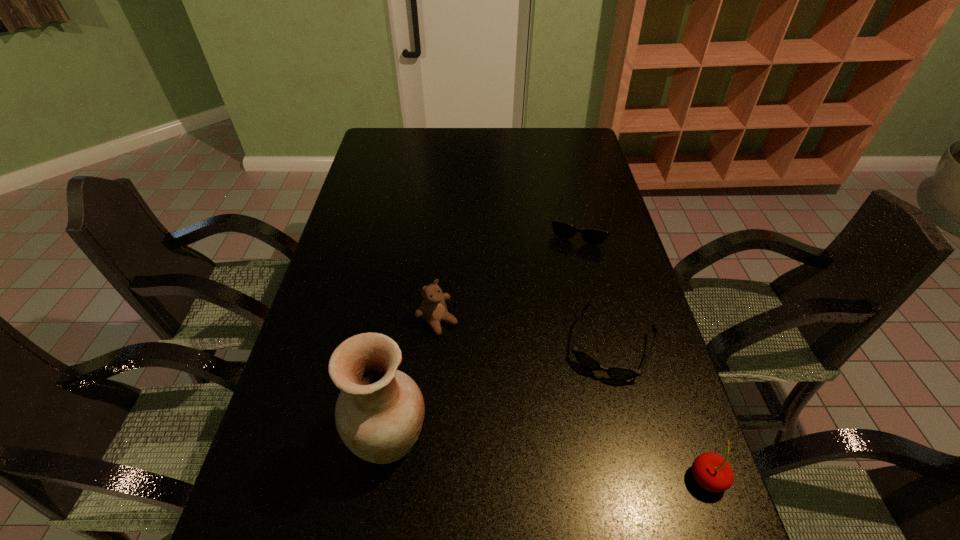
Where is `empty space that is in between the cherry and the teddy bear`? empty space that is in between the cherry and the teddy bear is located at coordinates (572, 400).

The image size is (960, 540). What are the coordinates of `empty space between the farther sunglasses and the nearer sunglasses` in the screenshot? It's located at (596, 285).

Find the location of `empty location between the cherry and the teddy bear`. empty location between the cherry and the teddy bear is located at coordinates pos(572,400).

Find the location of a particular element. This screenshot has height=540, width=960. free area in between the farthest object and the nearer sunglasses is located at coordinates (596, 285).

Where is `empty space that is in between the teddy bear and the tallest object`? The height and width of the screenshot is (540, 960). empty space that is in between the teddy bear and the tallest object is located at coordinates (414, 379).

Where is `free spot between the cherry and the farthest object`? Image resolution: width=960 pixels, height=540 pixels. free spot between the cherry and the farthest object is located at coordinates (644, 351).

The width and height of the screenshot is (960, 540). I want to click on the second closest object to the teddy bear, so click(x=619, y=373).

Where is `object that is the third closest one to the cherry`? object that is the third closest one to the cherry is located at coordinates [x=433, y=309].

The height and width of the screenshot is (540, 960). In order to click on vacant position in the image that satisfies the following two spatial constraints: 1. on the back side of the tallest object; 2. on the right side of the farther sunglasses in this screenshot , I will do `click(421, 224)`.

Image resolution: width=960 pixels, height=540 pixels. Identify the location of vacant area that satisfies the following two spatial constraints: 1. on the back side of the teddy bear; 2. on the left side of the pottery. (407, 321).